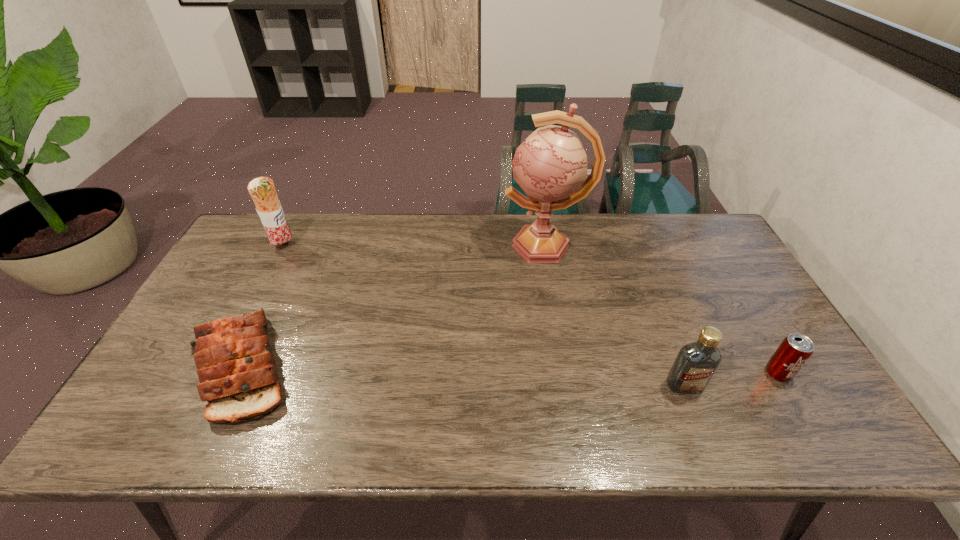
The height and width of the screenshot is (540, 960). I want to click on object located in the far left corner section of the desktop, so [x=262, y=190].

What are the coordinates of `object that is positioned at the near left corner` in the screenshot? It's located at (236, 367).

The height and width of the screenshot is (540, 960). What are the coordinates of `free region at the far edge` in the screenshot? It's located at (604, 231).

In the image, there is a desktop. Where is `vacant space at the near edge`? Image resolution: width=960 pixels, height=540 pixels. vacant space at the near edge is located at coordinates (333, 427).

Image resolution: width=960 pixels, height=540 pixels. Identify the location of vacant space at the left edge of the desktop. (164, 370).

You are a GUI agent. You are given a task and a screenshot of the screen. Output one action in this format:
    pyautogui.click(x=<x>, y=<y>)
    Task: Click on the vacant space at the right edge of the desktop
    
    Given the screenshot: What is the action you would take?
    pyautogui.click(x=704, y=266)

The width and height of the screenshot is (960, 540). In order to click on free location at the far left corner of the desktop in this screenshot , I will do `click(269, 242)`.

Find the location of a particular element. The image size is (960, 540). empty location between the rightmost object and the vodka is located at coordinates (732, 379).

Locate an element on the screen. Image resolution: width=960 pixels, height=540 pixels. free space between the second tallest object and the rightmost object is located at coordinates (531, 310).

Locate an element on the screen. The height and width of the screenshot is (540, 960). free spot between the second object from right to left and the second tallest object is located at coordinates (484, 316).